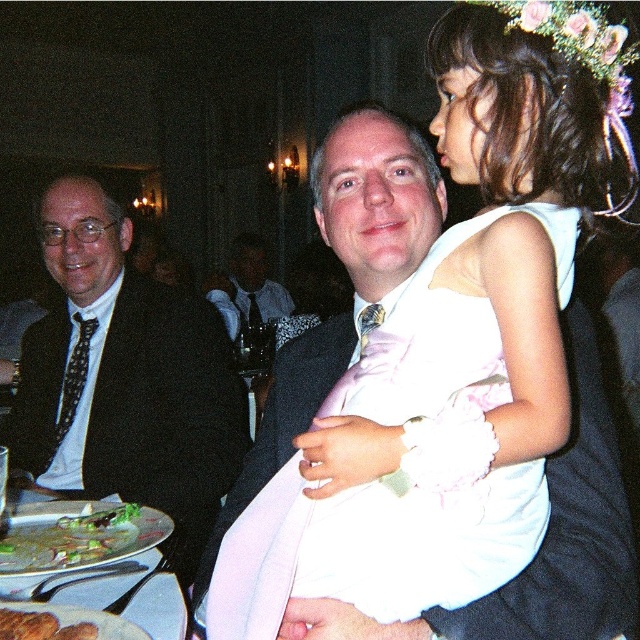
You are a photographer at the event and want to capture a closeup of the white satin dress at center. Based on its position coordinates, where should you aim your camera?

The white satin dress at center is located at coordinates point (403, 468), so aim your camera towards that point to capture the closeup.

You are a photographer at the event and need to capture a clear shot of both the matte black suit at center and the brown crumbly bread at lower left. Which object should you focus on first to ensure both are in focus?

You should focus on the matte black suit at center first because it is closer to you than the brown crumbly bread at lower left, so adjusting focus from near to far will help both be in focus.